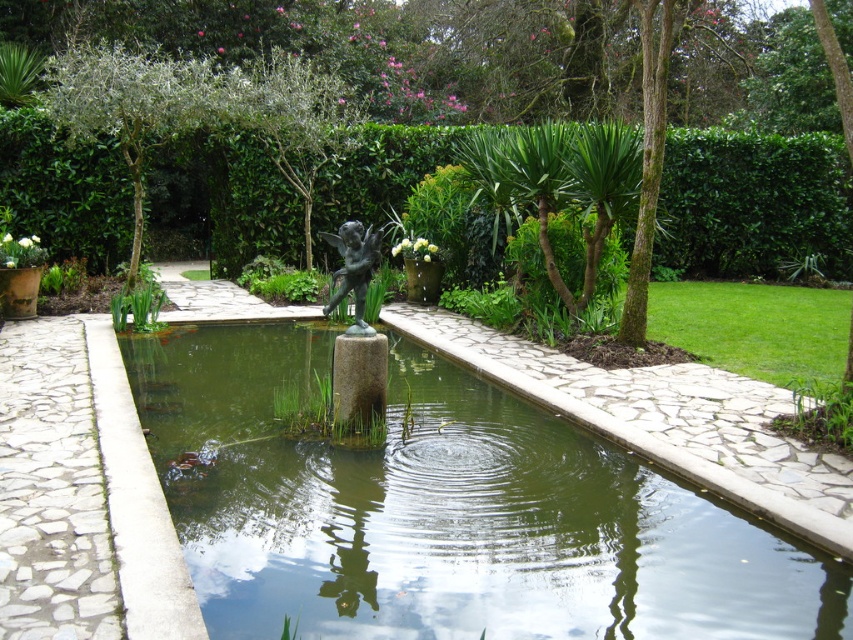
Question: Which point is closer to the camera?

Choices:
 (A) green stone pond at center
 (B) bronze statue at center

Answer: (A)

Question: Can you confirm if green stone pond at center is positioned to the left of bronze statue at center?

Choices:
 (A) no
 (B) yes

Answer: (A)

Question: Among these points, which one is nearest to the camera?

Choices:
 (A) (775, 576)
 (B) (345, 260)

Answer: (A)

Question: Can you confirm if green stone pond at center is positioned above bronze statue at center?

Choices:
 (A) no
 (B) yes

Answer: (A)

Question: Which of the following is the farthest from the observer?

Choices:
 (A) green stone pond at center
 (B) bronze statue at center

Answer: (B)

Question: Observing the image, what is the correct spatial positioning of green stone pond at center in reference to bronze statue at center?

Choices:
 (A) below
 (B) above

Answer: (A)